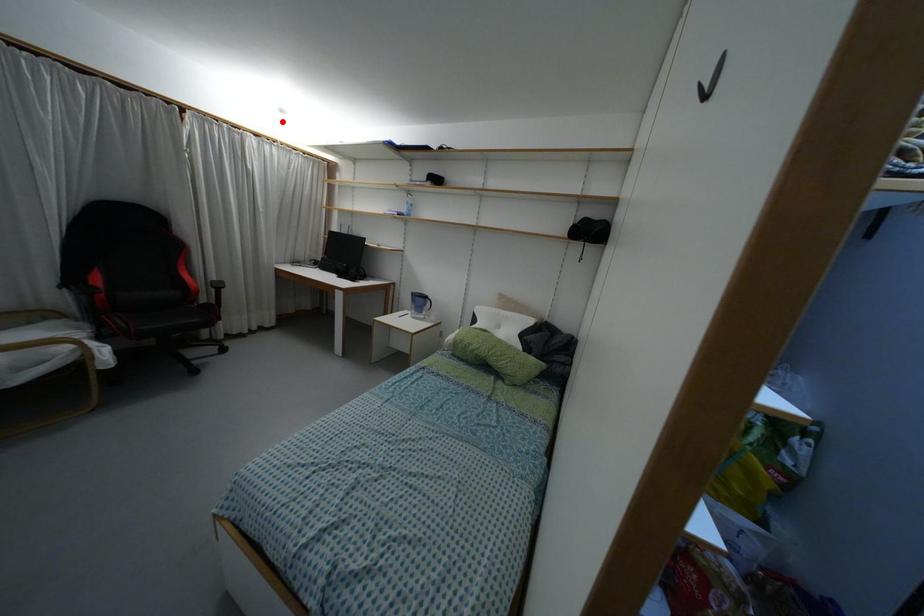
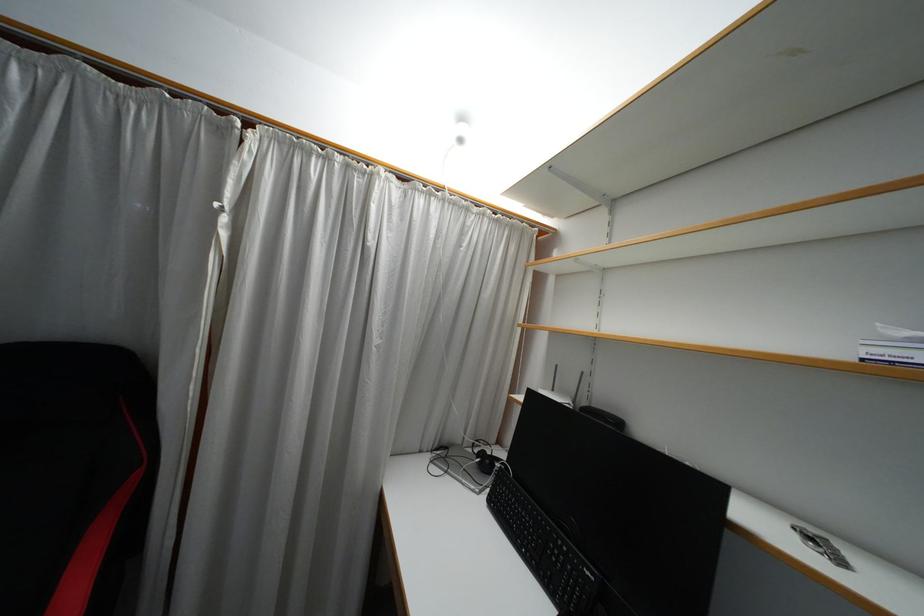
Locate, in the second image, the point that corresponds to the highlighted location in the first image.

(459, 140)